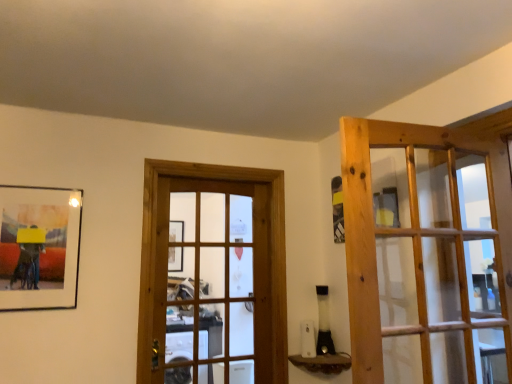
Question: Is brown textured wood at lower center completely or partially inside natural wood door at right, acting as the 2th door starting from the back?

Choices:
 (A) no
 (B) yes

Answer: (A)

Question: From a real-world perspective, is natural wood door at right, positioned as the first door in front-to-back order, physically above brown textured wood at lower center?

Choices:
 (A) no
 (B) yes

Answer: (B)

Question: From the image's perspective, is natural wood door at right, acting as the second door starting from the left, on top of brown textured wood at lower center?

Choices:
 (A) yes
 (B) no

Answer: (A)

Question: Does natural wood door at right, acting as the second door starting from the left, have a smaller size compared to brown textured wood at lower center?

Choices:
 (A) no
 (B) yes

Answer: (A)

Question: From the image's perspective, is natural wood door at right, the 1th door in the right-to-left sequence, located beneath brown textured wood at lower center?

Choices:
 (A) yes
 (B) no

Answer: (B)

Question: Is natural wood door at right, acting as the 2th door starting from the back, to the right of brown textured wood at lower center from the viewer's perspective?

Choices:
 (A) no
 (B) yes

Answer: (B)

Question: Is wooden door at center, which is counted as the 2th door, starting from the right, smaller than matte black picture frame at left?

Choices:
 (A) yes
 (B) no

Answer: (B)

Question: Is matte black picture frame at left at the back of wooden door at center, which is the 2th door in front-to-back order?

Choices:
 (A) yes
 (B) no

Answer: (B)

Question: From a real-world perspective, is wooden door at center, acting as the first door starting from the back, on matte black picture frame at left?

Choices:
 (A) no
 (B) yes

Answer: (A)

Question: Can you confirm if wooden door at center, which is counted as the 2th door, starting from the right, is shorter than matte black picture frame at left?

Choices:
 (A) yes
 (B) no

Answer: (B)

Question: Could you tell me if wooden door at center, which is the 2th door in front-to-back order, is turned towards matte black picture frame at left?

Choices:
 (A) yes
 (B) no

Answer: (B)

Question: Would you say wooden door at center, acting as the first door starting from the back, contains matte black picture frame at left?

Choices:
 (A) yes
 (B) no

Answer: (B)

Question: Are wooden door at center, acting as the first door starting from the back, and natural wood door at right, the 1th door in the right-to-left sequence, far apart?

Choices:
 (A) no
 (B) yes

Answer: (A)